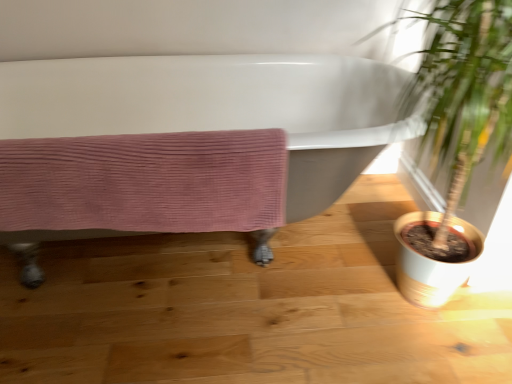
The width and height of the screenshot is (512, 384). What do you see at coordinates (456, 141) in the screenshot?
I see `green leafy plant at right` at bounding box center [456, 141].

This screenshot has width=512, height=384. Describe the element at coordinates (145, 182) in the screenshot. I see `pink corduroy towel at lower left` at that location.

I want to click on white glossy bathtub at center, so click(x=222, y=107).

Is pink corduroy towel at lower left oriented towards white glossy bathtub at center?

Yes, pink corduroy towel at lower left is aimed at white glossy bathtub at center.

Can you confirm if pink corduroy towel at lower left is wider than white glossy bathtub at center?

Incorrect, the width of pink corduroy towel at lower left does not surpass that of white glossy bathtub at center.

From the image's perspective, would you say pink corduroy towel at lower left is positioned over white glossy bathtub at center?

No.

In terms of height, does pink corduroy towel at lower left look taller or shorter compared to green leafy plant at right?

pink corduroy towel at lower left is shorter than green leafy plant at right.

From a real-world perspective, which is physically below, pink corduroy towel at lower left or green leafy plant at right?

In real-world perspective, pink corduroy towel at lower left is lower.

Between pink corduroy towel at lower left and green leafy plant at right, which one is positioned behind?

pink corduroy towel at lower left.

Image resolution: width=512 pixels, height=384 pixels. In order to click on bathtub below the green leafy plant at right (from the image's perspective) in this screenshot , I will do `click(222, 107)`.

Looking at their sizes, would you say white glossy bathtub at center is wider or thinner than green leafy plant at right?

Clearly, white glossy bathtub at center has more width compared to green leafy plant at right.

From the image's perspective, between white glossy bathtub at center and green leafy plant at right, who is located below?

From the image's view, white glossy bathtub at center is below.

Which point is more distant from viewer, (443, 134) or (33, 130)?

Positioned behind is point (33, 130).

How different are the orientations of green leafy plant at right and white glossy bathtub at center in degrees?

green leafy plant at right and white glossy bathtub at center are facing 0.435 degrees away from each other.

From a real-world perspective, is green leafy plant at right positioned above or below white glossy bathtub at center?

In terms of real-world spatial position, green leafy plant at right is above white glossy bathtub at center.

Between green leafy plant at right and white glossy bathtub at center, which one has less height?

Standing shorter between the two is white glossy bathtub at center.

Is there a large distance between white glossy bathtub at center and pink corduroy towel at lower left?

No, there isn't a large distance between white glossy bathtub at center and pink corduroy towel at lower left.

Is white glossy bathtub at center bigger than pink corduroy towel at lower left?

Yes.

Where is `bath towel above the white glossy bathtub at center (from a real-world perspective)`? The width and height of the screenshot is (512, 384). bath towel above the white glossy bathtub at center (from a real-world perspective) is located at coordinates (145, 182).

Is white glossy bathtub at center turned away from pink corduroy towel at lower left?

Correct, white glossy bathtub at center is looking away from pink corduroy towel at lower left.

Is point (507, 103) closer or farther from the camera than point (256, 197)?

Point (507, 103) appears to be closer to the viewer than point (256, 197).

Could you tell me if green leafy plant at right is turned towards pink corduroy towel at lower left?

Result: No, green leafy plant at right is not aimed at pink corduroy towel at lower left.

Between green leafy plant at right and pink corduroy towel at lower left, which one has less height?

Standing shorter between the two is pink corduroy towel at lower left.

Where is `bath towel above the white glossy bathtub at center (from a real-world perspective)`? bath towel above the white glossy bathtub at center (from a real-world perspective) is located at coordinates (145, 182).

The height and width of the screenshot is (384, 512). In order to click on houseplant above the pink corduroy towel at lower left (from the image's perspective) in this screenshot , I will do `click(456, 141)`.

Which object lies nearer to the anchor point white glossy bathtub at center, green leafy plant at right or pink corduroy towel at lower left?

The object closer to white glossy bathtub at center is green leafy plant at right.

Which object lies nearer to the anchor point green leafy plant at right, pink corduroy towel at lower left or white glossy bathtub at center?

Based on the image, pink corduroy towel at lower left appears to be nearer to green leafy plant at right.

Considering their positions, is white glossy bathtub at center positioned further to green leafy plant at right than pink corduroy towel at lower left?

white glossy bathtub at center is positioned further to the anchor green leafy plant at right.

Estimate the real-world distances between objects in this image. Which object is closer to pink corduroy towel at lower left, green leafy plant at right or white glossy bathtub at center?

The object closer to pink corduroy towel at lower left is green leafy plant at right.

Looking at this image, which object lies further to the anchor point pink corduroy towel at lower left, white glossy bathtub at center or green leafy plant at right?

white glossy bathtub at center is positioned further to the anchor pink corduroy towel at lower left.

Considering their positions, is pink corduroy towel at lower left positioned further to white glossy bathtub at center than green leafy plant at right?

pink corduroy towel at lower left is further to white glossy bathtub at center.

Where is `bathtub located between pink corduroy towel at lower left and green leafy plant at right in the left-right direction`? bathtub located between pink corduroy towel at lower left and green leafy plant at right in the left-right direction is located at coordinates (222, 107).